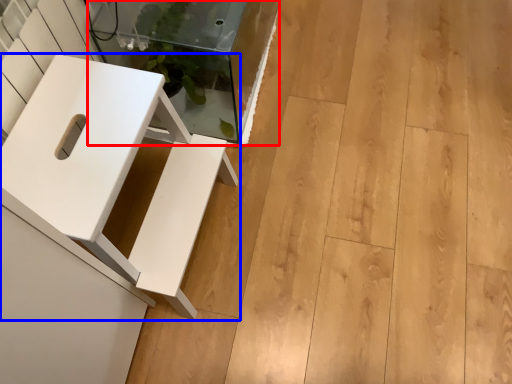
Question: Which point is closer to the camera, glass table (highlighted by a red box) or furniture (highlighted by a blue box)?

Choices:
 (A) glass table
 (B) furniture

Answer: (B)